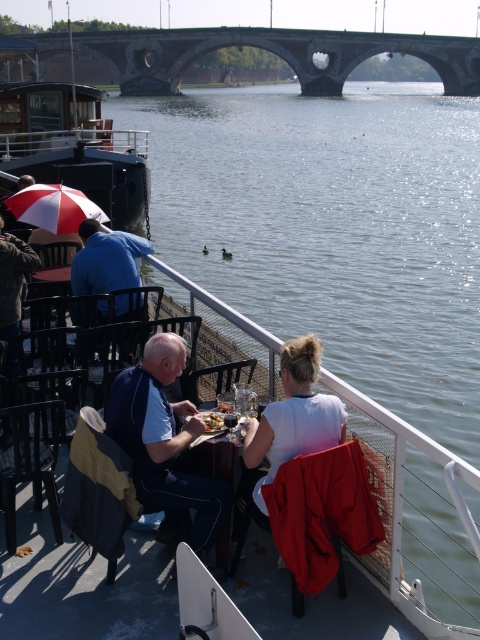
You are standing at the point marked by the coordinate (54, 208) in this riverside scene. Looking around, you see a red and white striped umbrella at left. Which direction should you walk to reach the red and white striped umbrella at left?

The red and white striped umbrella at left is located at the point marked by the coordinate (54, 208), so you are already at the location of the red and white striped umbrella at left.

You are a photographer trying to capture a closeup of the blue cotton shirt at left without including the red and white striped umbrella at left in the frame. Is this possible based on their positions?

The blue cotton shirt at left is in front of the red and white striped umbrella at left, so you can take a closeup of the blue cotton shirt at left without the umbrella being visible in the frame.

You are a photographer trying to capture a closeup of the blue cotton shirt at left without including the red and white striped umbrella at left in the frame. Given their positions, is this possible?

The blue cotton shirt at left is taller than the red and white striped umbrella at left, so if you position the camera lower and focus on the shirt, you can exclude the umbrella from the shot.